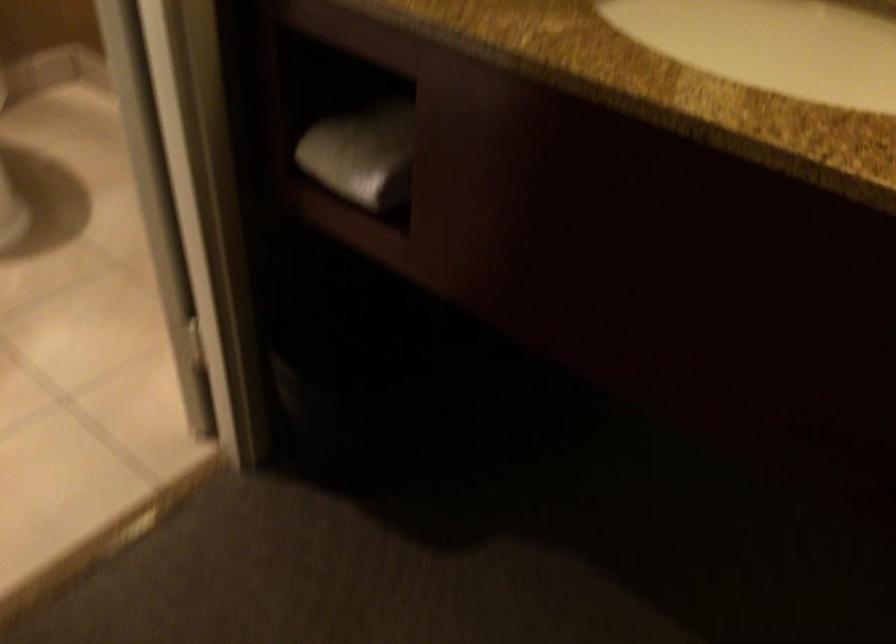
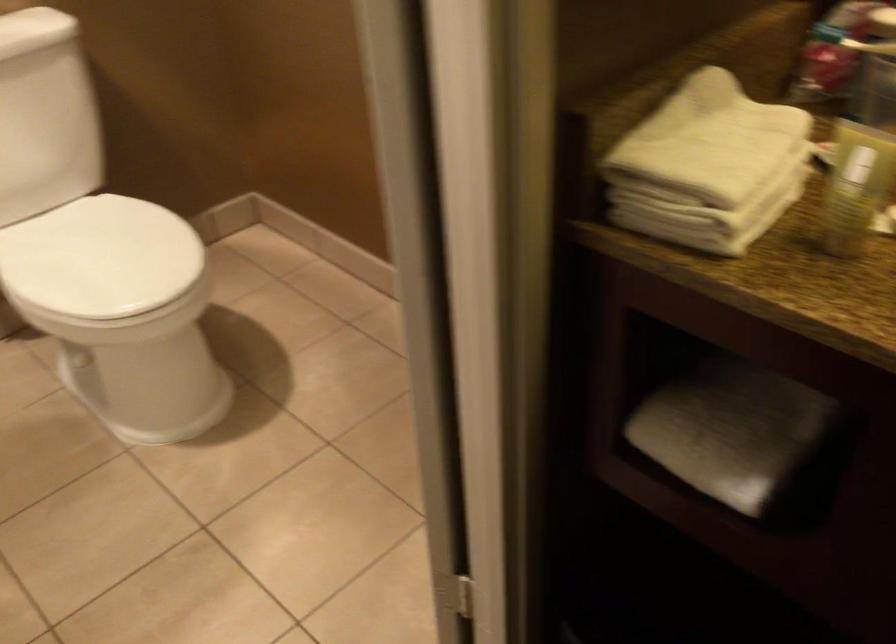
Question: The first image is from the beginning of the video and the second image is from the end. How did the camera likely rotate when shooting the video?

Choices:
 (A) Left
 (B) Right
 (C) Up
 (D) Down

Answer: (A)